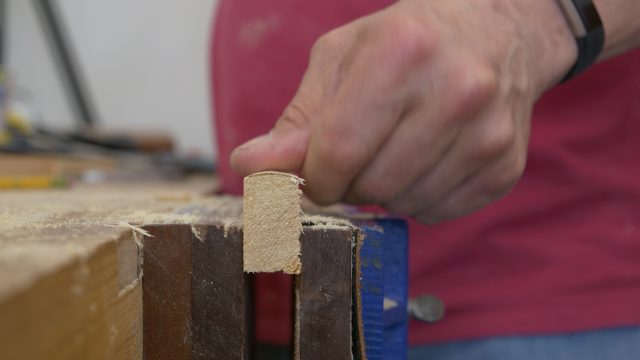
Where is `wooden bench`? wooden bench is located at coordinates (65, 231).